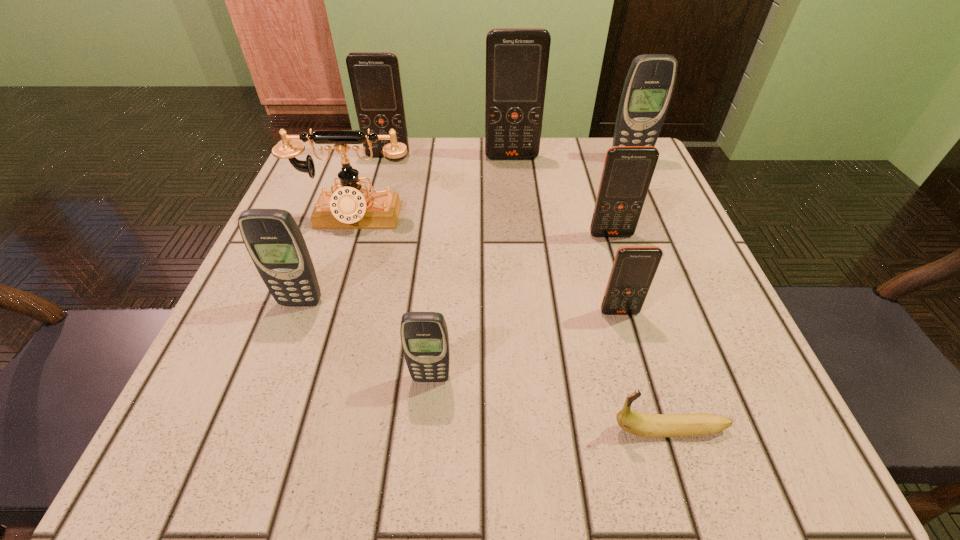
Where is `object that is at the far left corner`? This screenshot has height=540, width=960. object that is at the far left corner is located at coordinates (375, 80).

Find the location of a particular element. The image size is (960, 540). object present at the far right corner is located at coordinates (648, 88).

At what (x,y) coordinates should I click in order to perform the action: click on object positioned at the near right corner. Please return your answer as a coordinate pair (x, y). Looking at the image, I should click on 642,424.

Where is `vacant space at the far edge`? The height and width of the screenshot is (540, 960). vacant space at the far edge is located at coordinates (564, 172).

The width and height of the screenshot is (960, 540). In the image, there is a desktop. What are the coordinates of `vacant space at the near edge` in the screenshot? It's located at (637, 465).

In the image, there is a desktop. Where is `free space at the left edge`? The image size is (960, 540). free space at the left edge is located at coordinates (244, 341).

Locate an element on the screen. free region at the right edge of the desktop is located at coordinates (635, 347).

In the image, there is a desktop. Identify the location of free space at the far left corner. Image resolution: width=960 pixels, height=540 pixels. (313, 156).

You are a GUI agent. You are given a task and a screenshot of the screen. Output one action in this format:
    pyautogui.click(x=<x>, y=<y>)
    Task: Click on the vacant region at the near left corner
    The image size is (960, 540).
    Given the screenshot: What is the action you would take?
    pyautogui.click(x=247, y=420)

You are a GUI agent. You are given a task and a screenshot of the screen. Output one action in this format:
    pyautogui.click(x=<x>, y=<y>)
    Task: Click on the vacant space at the far right corner
    The image size is (960, 540).
    Given the screenshot: What is the action you would take?
    pyautogui.click(x=589, y=136)